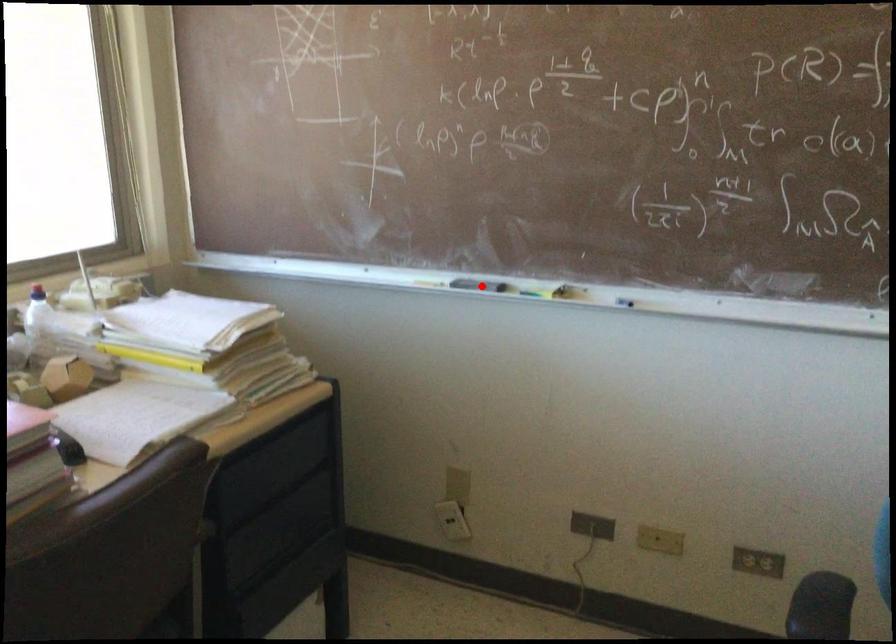
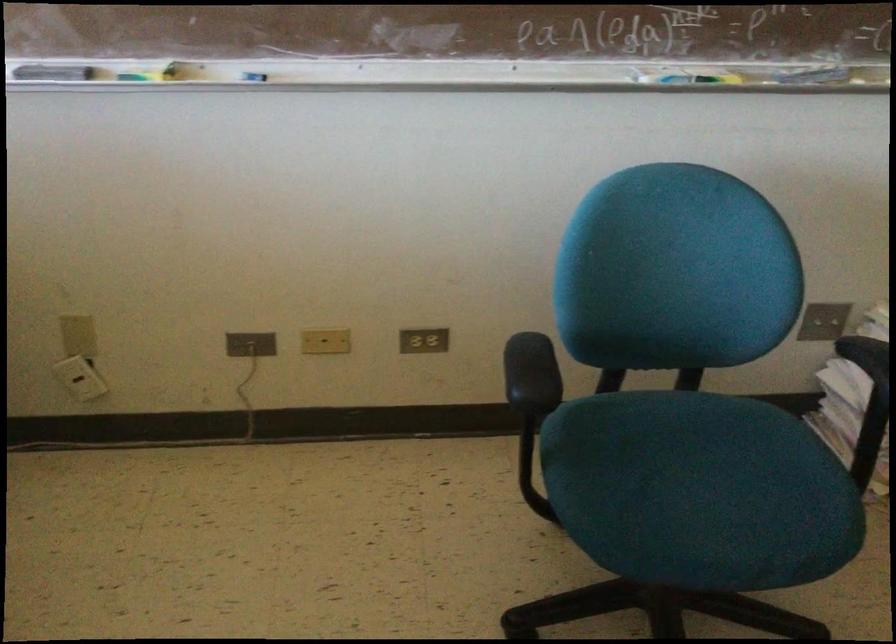
Question: I am providing you with two images of the same scene from different viewpoints. Given a red point in image1, look at the same physical point in image2. Is it:

Choices:
 (A) Closer to the viewpoint
 (B) Farther from the viewpoint

Answer: (A)